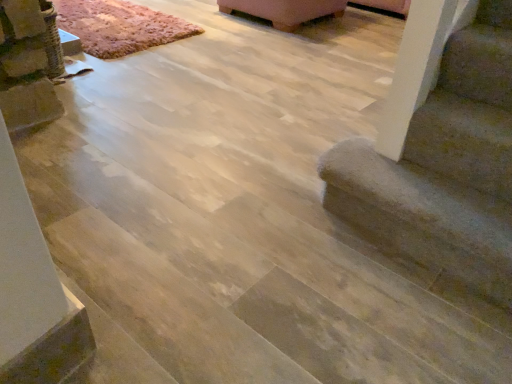
Locate an element on the screen. rustic wool rug at upper left is located at coordinates (119, 26).

What do you see at coordinates (119, 26) in the screenshot?
I see `rustic wool rug at upper left` at bounding box center [119, 26].

This screenshot has width=512, height=384. Identify the location of smooth concrete stairs at lower right. (x=444, y=166).

Measure the distance between smooth concrete stairs at lower right and camera.

smooth concrete stairs at lower right is 3.65 feet from camera.

What do you see at coordinates (444, 166) in the screenshot? The image size is (512, 384). I see `smooth concrete stairs at lower right` at bounding box center [444, 166].

The width and height of the screenshot is (512, 384). Identify the location of rustic wool rug at upper left. (119, 26).

Considering the relative positions of rustic wool rug at upper left and smooth concrete stairs at lower right in the image provided, is rustic wool rug at upper left to the left of smooth concrete stairs at lower right from the viewer's perspective?

Correct, you'll find rustic wool rug at upper left to the left of smooth concrete stairs at lower right.

Looking at this image, considering the positions of objects rustic wool rug at upper left and smooth concrete stairs at lower right in the image provided, who is behind, rustic wool rug at upper left or smooth concrete stairs at lower right?

rustic wool rug at upper left is behind.

Does point (113, 1) come farther from viewer compared to point (500, 163)?

Yes, point (113, 1) is farther from viewer.

From the image's perspective, is rustic wool rug at upper left located beneath smooth concrete stairs at lower right?

No.

From a real-world perspective, relative to smooth concrete stairs at lower right, is rustic wool rug at upper left vertically above or below?

Clearly, from a real-world perspective, rustic wool rug at upper left is below smooth concrete stairs at lower right.

Considering the relative sizes of rustic wool rug at upper left and smooth concrete stairs at lower right in the image provided, is rustic wool rug at upper left thinner than smooth concrete stairs at lower right?

In fact, rustic wool rug at upper left might be wider than smooth concrete stairs at lower right.

Between rustic wool rug at upper left and smooth concrete stairs at lower right, which one has less height?

Standing shorter between the two is rustic wool rug at upper left.

Can you confirm if rustic wool rug at upper left is smaller than smooth concrete stairs at lower right?

Actually, rustic wool rug at upper left might be larger than smooth concrete stairs at lower right.

Would you say smooth concrete stairs at lower right is part of rustic wool rug at upper left's contents?

Actually, smooth concrete stairs at lower right is outside rustic wool rug at upper left.

Is rustic wool rug at upper left positioned far away from smooth concrete stairs at lower right?

Yes, rustic wool rug at upper left is far from smooth concrete stairs at lower right.

Does rustic wool rug at upper left turn towards smooth concrete stairs at lower right?

No, rustic wool rug at upper left is not oriented towards smooth concrete stairs at lower right.

What's the angular difference between rustic wool rug at upper left and smooth concrete stairs at lower right's facing directions?

The angular difference between rustic wool rug at upper left and smooth concrete stairs at lower right is 179 degrees.

Measure the distance between rustic wool rug at upper left and smooth concrete stairs at lower right.

rustic wool rug at upper left is 6.92 feet from smooth concrete stairs at lower right.

Image resolution: width=512 pixels, height=384 pixels. I want to click on mat on the left of the smooth concrete stairs at lower right, so tap(119, 26).

In the scene shown: Considering the relative positions of smooth concrete stairs at lower right and rustic wool rug at upper left in the image provided, is smooth concrete stairs at lower right to the left or to the right of rustic wool rug at upper left?

Clearly, smooth concrete stairs at lower right is on the right of rustic wool rug at upper left in the image.

Is smooth concrete stairs at lower right in front of rustic wool rug at upper left?

Yes, smooth concrete stairs at lower right is closer to the viewer.

Which is less distant, (419, 195) or (148, 26)?

The point (419, 195) is in front.

From the image's perspective, between smooth concrete stairs at lower right and rustic wool rug at upper left, which one is located above?

rustic wool rug at upper left, from the image's perspective.

From a real-world perspective, is smooth concrete stairs at lower right positioned over rustic wool rug at upper left based on gravity?

Yes, from a real-world perspective, smooth concrete stairs at lower right is above rustic wool rug at upper left.

Is smooth concrete stairs at lower right thinner than rustic wool rug at upper left?

Correct, the width of smooth concrete stairs at lower right is less than that of rustic wool rug at upper left.

Can you confirm if smooth concrete stairs at lower right is shorter than rustic wool rug at upper left?

Incorrect, the height of smooth concrete stairs at lower right does not fall short of that of rustic wool rug at upper left.

Is smooth concrete stairs at lower right smaller than rustic wool rug at upper left?

Yes.

Is smooth concrete stairs at lower right outside of rustic wool rug at upper left?

Yes, smooth concrete stairs at lower right is located beyond the bounds of rustic wool rug at upper left.

Is smooth concrete stairs at lower right touching rustic wool rug at upper left?

There is a gap between smooth concrete stairs at lower right and rustic wool rug at upper left.

Could you tell me if smooth concrete stairs at lower right is facing rustic wool rug at upper left?

No, smooth concrete stairs at lower right is not oriented towards rustic wool rug at upper left.

What's the angular difference between smooth concrete stairs at lower right and rustic wool rug at upper left's facing directions?

The facing directions of smooth concrete stairs at lower right and rustic wool rug at upper left are 179 degrees apart.

The width and height of the screenshot is (512, 384). I want to click on mat above the smooth concrete stairs at lower right (from the image's perspective), so click(119, 26).

Find the location of a particular element. The image size is (512, 384). mat beneath the smooth concrete stairs at lower right (from a real-world perspective) is located at coordinates (119, 26).

Where is `stairs that appears on the right of rustic wool rug at upper left`? The height and width of the screenshot is (384, 512). stairs that appears on the right of rustic wool rug at upper left is located at coordinates (444, 166).